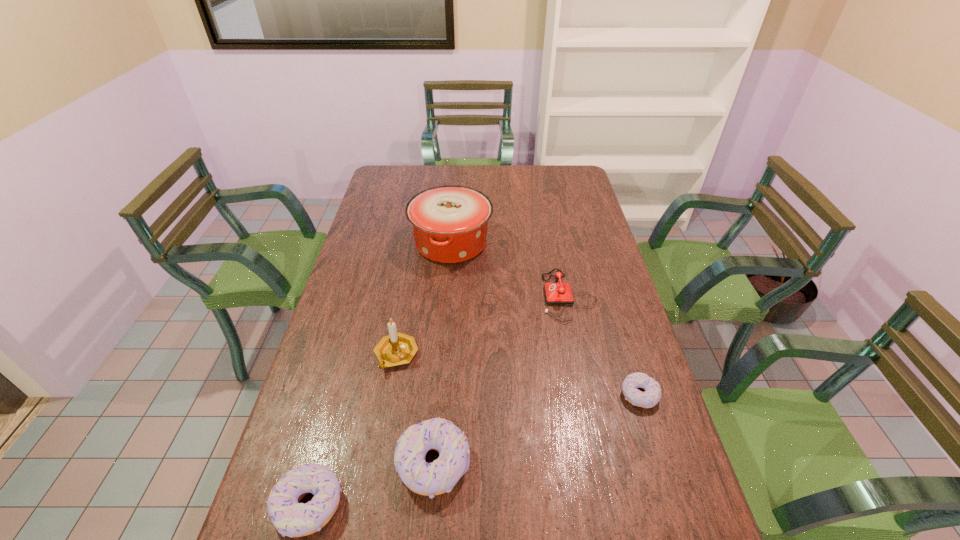
Find the location of a particular element. This screenshot has width=960, height=540. the second closest object relative to the farthest doughnut is located at coordinates (429, 479).

Locate which object is the fourth closest to the second doughnut from right to left. Please provide its 2D coordinates. Your answer should be formatted as a tuple, i.e. [(x, y)], where the tuple contains the x and y coordinates of a point satisfying the conditions above.

[(558, 293)]

At what (x,y) coordinates should I click in order to perform the action: click on doughnut that is the closest to the second doughnut from left to right. Please return your answer as a coordinate pair (x, y). This screenshot has height=540, width=960. Looking at the image, I should click on (291, 518).

Identify which doughnut is the third nearest to the candle holder. Please provide its 2D coordinates. Your answer should be formatted as a tuple, i.e. [(x, y)], where the tuple contains the x and y coordinates of a point satisfying the conditions above.

[(648, 399)]

Find the location of a particular element. The image size is (960, 540). free space that satisfies the following two spatial constraints: 1. on the dial of the telephone; 2. on the front side of the second doughnut from left to right is located at coordinates (604, 464).

At what (x,y) coordinates should I click in order to perform the action: click on free space that satisfies the following two spatial constraints: 1. on the front side of the shortest doughnut; 2. on the right side of the casserole. Please return your answer as a coordinate pair (x, y). The width and height of the screenshot is (960, 540). Looking at the image, I should click on (439, 395).